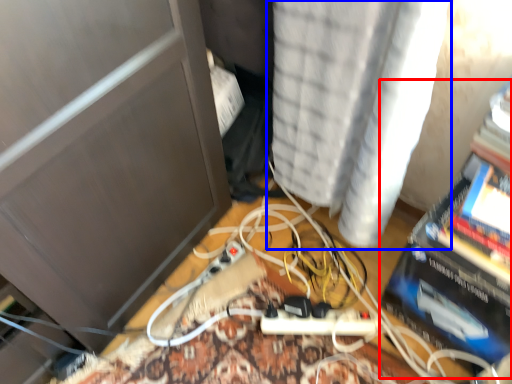
Question: Which object appears farthest to the camera in this image, paperback book (highlighted by a red box) or curtain (highlighted by a blue box)?

Choices:
 (A) paperback book
 (B) curtain

Answer: (A)